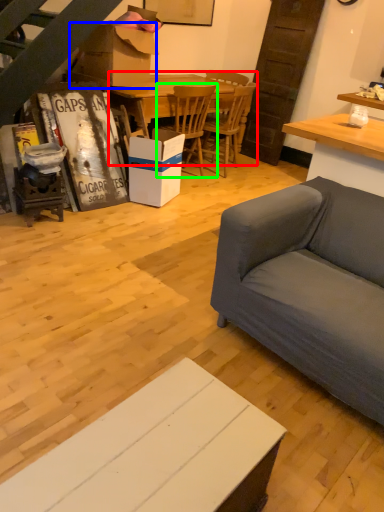
Question: Estimate the real-world distances between objects in this image. Which object is farther from kitchen & dining room table (highlighted by a red box), cardboard box (highlighted by a blue box) or chair (highlighted by a green box)?

Choices:
 (A) cardboard box
 (B) chair

Answer: (A)